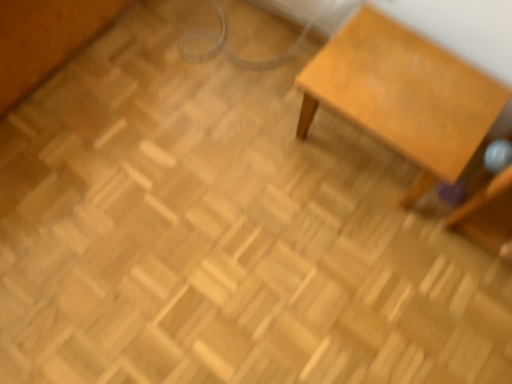
The image size is (512, 384). What are the coordinates of `light brown wooden table at upper right` in the screenshot? It's located at (403, 95).

Describe the element at coordinates (403, 95) in the screenshot. The height and width of the screenshot is (384, 512). I see `light brown wooden table at upper right` at that location.

The image size is (512, 384). Find the location of `light brown wooden table at upper right`. light brown wooden table at upper right is located at coordinates (403, 95).